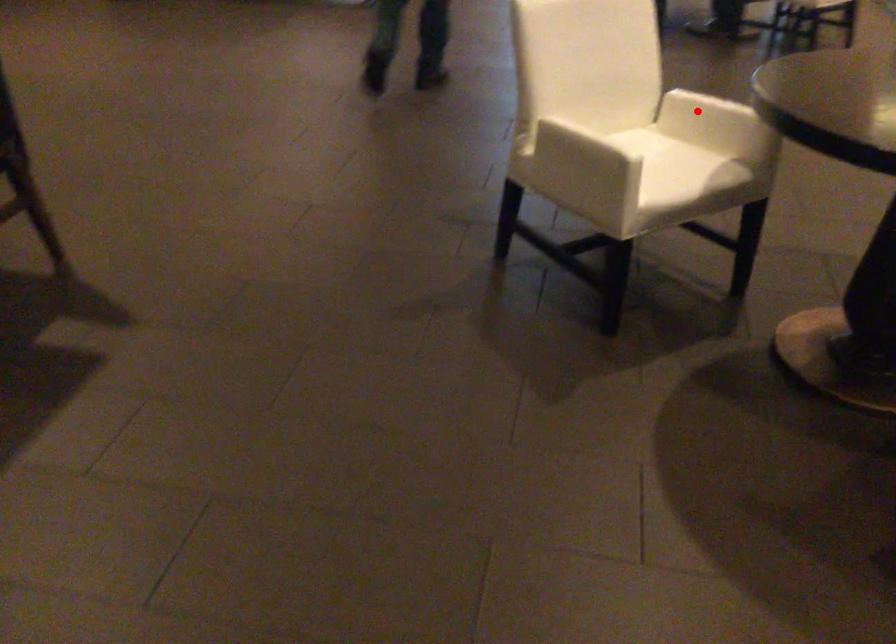
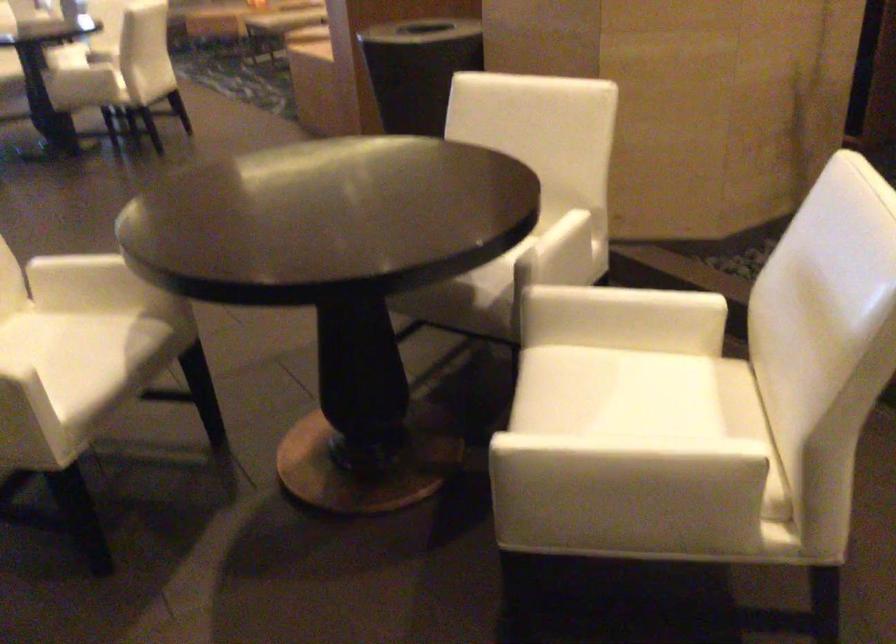
Locate, in the second image, the point that corresponds to the highlighted location in the first image.

(80, 279)